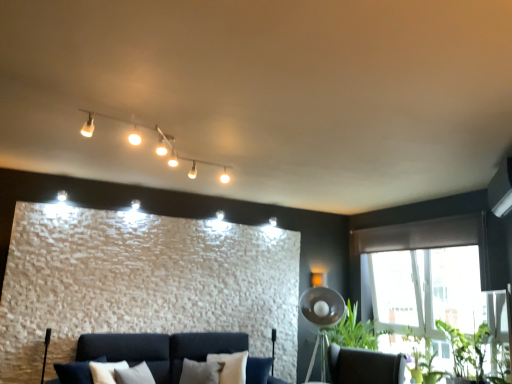
Question: From their relative heights in the image, would you say brown fabric curtain at upper right is taller or shorter than metallic silver tripod lamp at lower right?

Choices:
 (A) short
 (B) tall

Answer: (A)

Question: In terms of size, does brown fabric curtain at upper right appear bigger or smaller than metallic silver tripod lamp at lower right?

Choices:
 (A) big
 (B) small

Answer: (B)

Question: Estimate the real-world distances between objects in this image. Which object is farther from the dark brown leather swivel chair at lower right?

Choices:
 (A) brown fabric curtain at upper right
 (B) matte white track lights at upper center
 (C) green leafy plant at lower right, the second plant in the back-to-front sequence
 (D) green matte plant at lower right, marked as the second plant in a front-to-back arrangement
 (E) metallic silver tripod lamp at lower right

Answer: (B)

Question: Estimate the real-world distances between objects in this image. Which object is farther from the green leafy plant at lower right, the second plant in the back-to-front sequence?

Choices:
 (A) brown fabric curtain at upper right
 (B) metallic silver tripod lamp at lower right
 (C) dark brown leather swivel chair at lower right
 (D) matte white track lights at upper center
 (E) green matte plant at lower right, acting as the 1th plant starting from the back

Answer: (D)